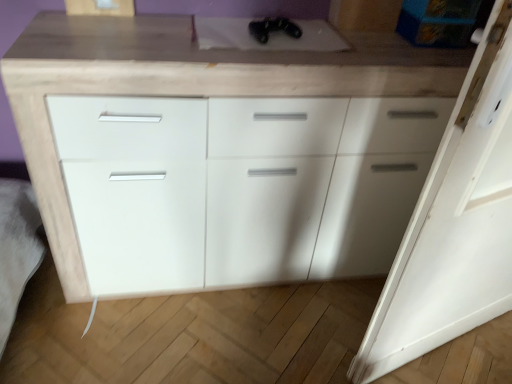
Identify the location of vacant space that is to the left of white matte door at right. The image size is (512, 384). tap(303, 327).